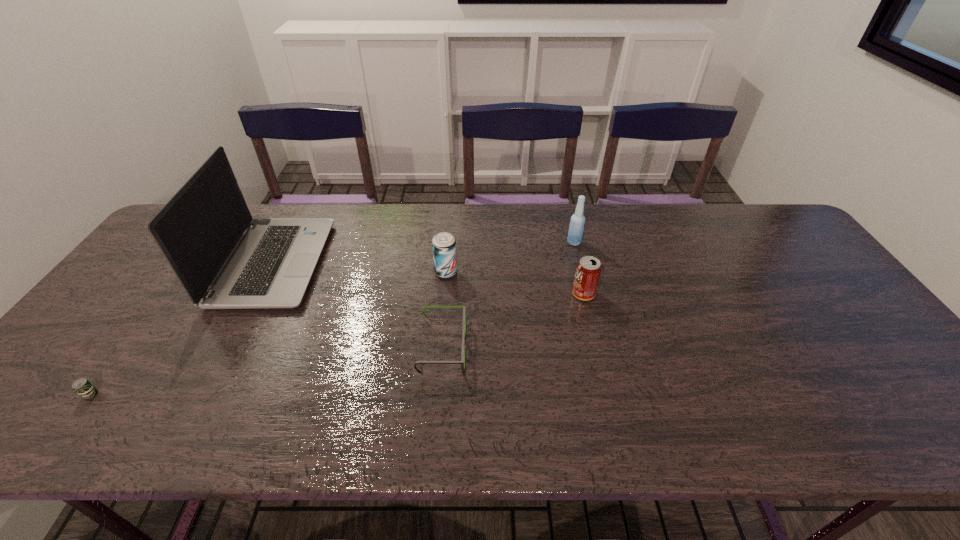
Locate an element on the screen. free space located on the screen of the laptop computer is located at coordinates (421, 263).

I want to click on free space located 0.050m on the left of the bottle, so click(x=551, y=242).

Find the location of a particular element. This screenshot has height=540, width=960. free location located 0.270m on the right of the farther beer can is located at coordinates (550, 272).

Where is `free spot located 0.110m on the front of the soda can`? The width and height of the screenshot is (960, 540). free spot located 0.110m on the front of the soda can is located at coordinates (593, 334).

Where is `vacant position located 0.110m on the lens of the second shortest object`? vacant position located 0.110m on the lens of the second shortest object is located at coordinates (510, 348).

You are a GUI agent. You are given a task and a screenshot of the screen. Output one action in this format:
    pyautogui.click(x=<x>, y=<y>)
    Task: Click on the free space located 0.380m on the right of the leftmost object
    This screenshot has height=540, width=960.
    Given the screenshot: What is the action you would take?
    pyautogui.click(x=283, y=395)

Find the location of a particular element. laptop computer situated at the far edge is located at coordinates (224, 259).

Find the location of `bottle that is at the far edge`. bottle that is at the far edge is located at coordinates (575, 233).

Locate an element on the screen. object that is positioned at the near edge is located at coordinates (82, 386).

At what (x,y) coordinates should I click in order to perform the action: click on object present at the left edge. Please return your answer as a coordinate pair (x, y). This screenshot has height=540, width=960. Looking at the image, I should click on (82, 386).